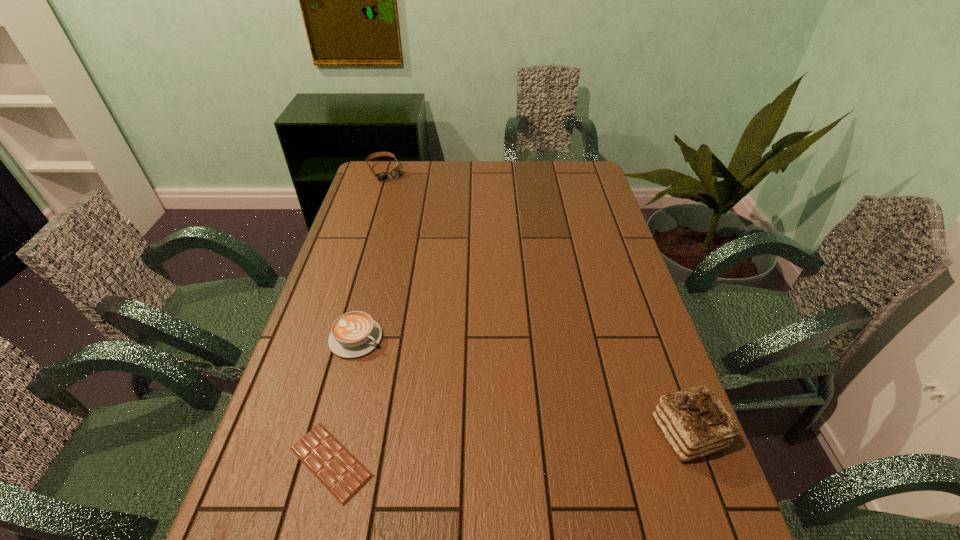
Locate an element on the screen. This screenshot has width=960, height=540. free point that satisfies the following two spatial constraints: 1. on the front side of the cappuccino; 2. on the left side of the rightmost object is located at coordinates (331, 433).